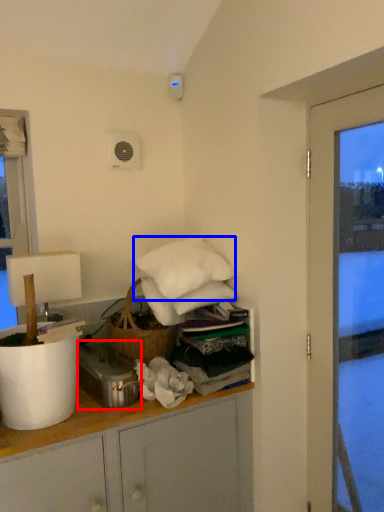
Question: Which point is further to the camera, appliance (highlighted by a red box) or pillow (highlighted by a blue box)?

Choices:
 (A) appliance
 (B) pillow

Answer: (B)